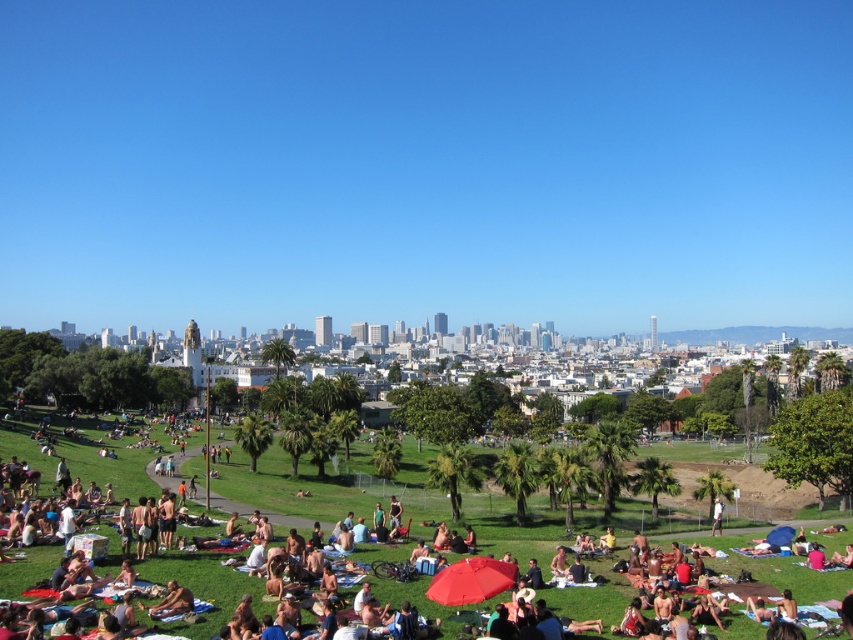
Which is below, matte black tent at center or tan skin person at lower left?

Positioned lower is tan skin person at lower left.

Is matte black tent at center to the right of tan skin person at lower left from the viewer's perspective?

Indeed, matte black tent at center is positioned on the right side of tan skin person at lower left.

At what (x,y) coordinates should I click in order to perform the action: click on matte black tent at center. Please return your answer as a coordinate pair (x, y). Looking at the image, I should click on (200, 577).